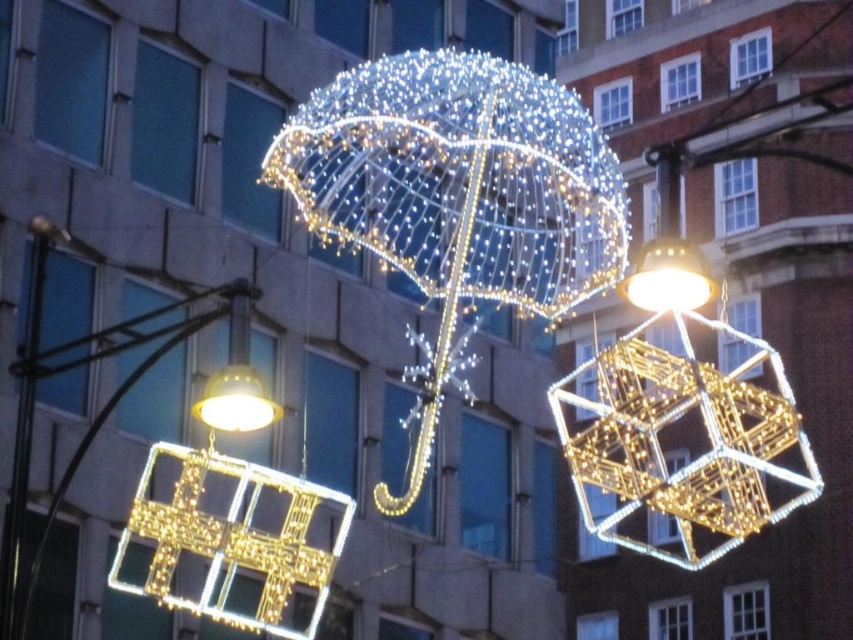
Question: Which point is farther from the camera taking this photo?

Choices:
 (A) (245, 408)
 (B) (636, 284)

Answer: (A)

Question: Which point is farther from the camera taking this photo?

Choices:
 (A) (776, 371)
 (B) (322, 168)
 (C) (260, 392)
 (D) (41, 257)

Answer: (B)

Question: Can you confirm if iridescent glass cube at center is positioned below matte gold cube at upper center?

Choices:
 (A) no
 (B) yes

Answer: (B)

Question: Can you confirm if iridescent glass cube at center is thinner than matte gold light at lower left?

Choices:
 (A) no
 (B) yes

Answer: (A)

Question: Is iridescent glass cube at center below matte gold light at lower left?

Choices:
 (A) no
 (B) yes

Answer: (B)

Question: Which point is farther to the camera?

Choices:
 (A) matte gold light at lower left
 (B) iridescent glass cube at center

Answer: (A)